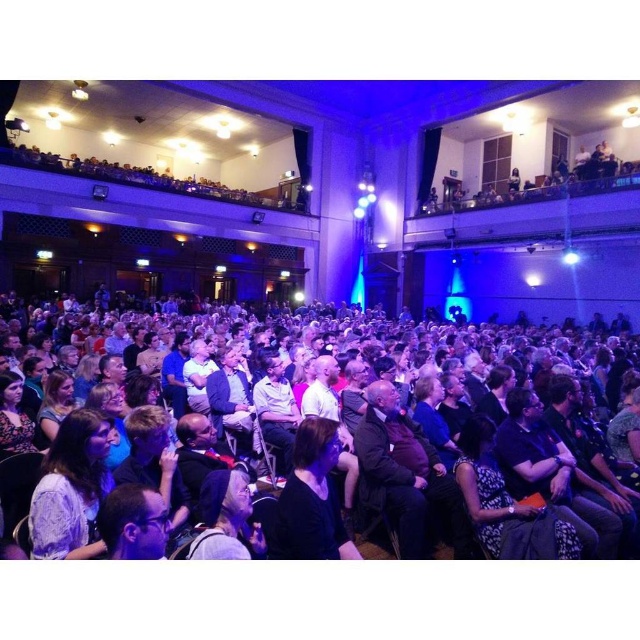
Which is more to the left, light purple lace dress at lower left or dark brown leather jacket at center?

Positioned to the left is light purple lace dress at lower left.

Between point (88, 444) and point (253, 531), which one is positioned in front?

Positioned in front is point (253, 531).

Is point (106, 417) less distant than point (240, 516)?

No, it is not.

At what (x,y) coordinates should I click in order to perform the action: click on light purple lace dress at lower left. Please return your answer as a coordinate pair (x, y). Looking at the image, I should click on (72, 488).

Is black matte shirt at center to the left of dark brown leather jacket at center from the viewer's perspective?

In fact, black matte shirt at center is to the right of dark brown leather jacket at center.

What do you see at coordinates (310, 499) in the screenshot? I see `black matte shirt at center` at bounding box center [310, 499].

This screenshot has width=640, height=640. In order to click on black matte shirt at center in this screenshot , I will do `click(310, 499)`.

Who is positioned more to the left, light purple lace dress at lower left or black matte shirt at center?

From the viewer's perspective, light purple lace dress at lower left appears more on the left side.

Does point (68, 472) lie behind point (323, 452)?

No, it is in front of (323, 452).

This screenshot has width=640, height=640. In order to click on light purple lace dress at lower left in this screenshot , I will do `click(72, 488)`.